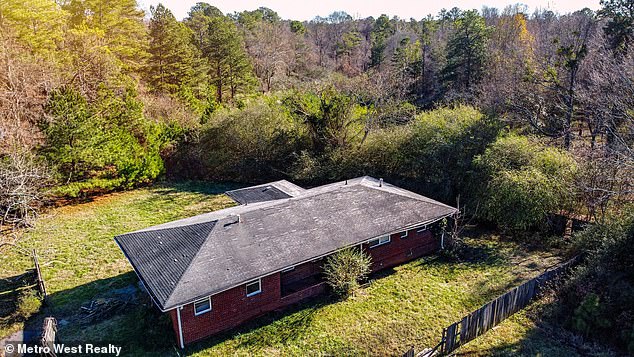
The height and width of the screenshot is (357, 634). I want to click on shade, so click(576, 338).